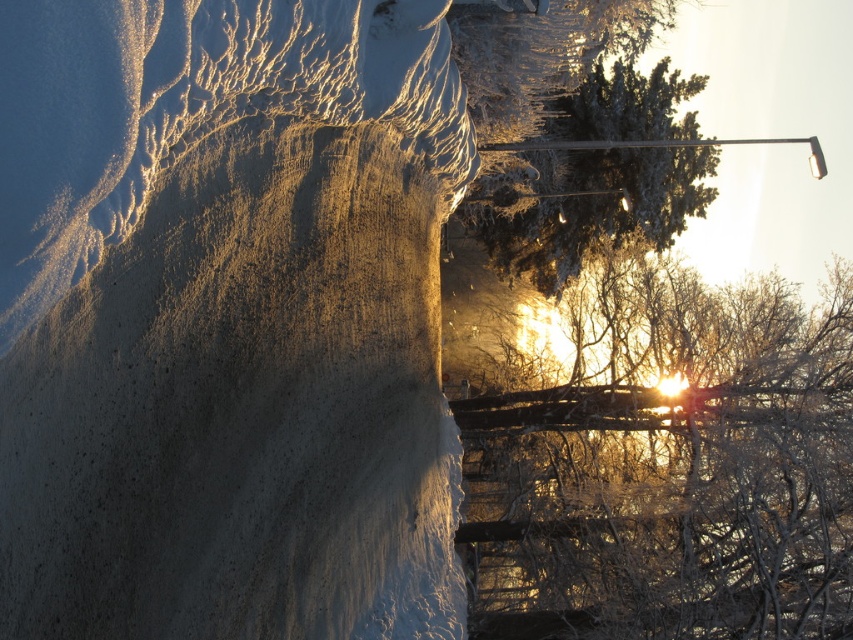
You are an artist planning to paint the winter scene. You want to ensure the smooth concrete cliff at center and the frosty white branches at upper right are positioned correctly in terms of depth. Based on the scene, which object should appear larger in your painting?

The smooth concrete cliff at center should appear larger because it is closer to the viewer than the frosty white branches at upper right.

You are standing at the point marked as point (225, 317) in the winter scene. What type of terrain are you currently standing on?

You are standing on a smooth concrete cliff at center.